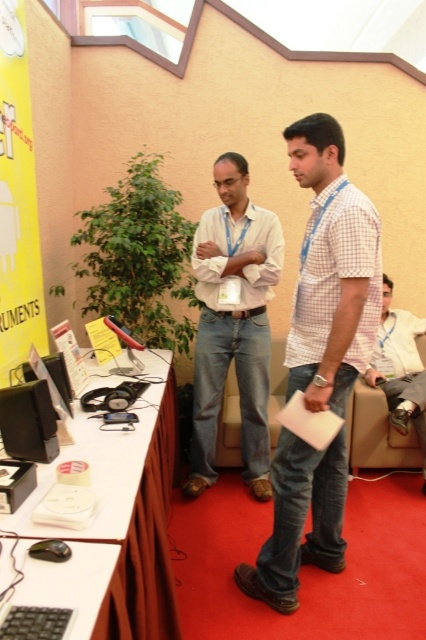
You are organizing a conference and need to place a name tag on the table. The name tag must be placed above the light beige shirt at center. Where should you place it relative to the yellow paper at upper left?

The light beige shirt at center is positioned under the yellow paper at upper left, so to place the name tag above the light beige shirt at center, you should position it between the yellow paper at upper left and the light beige shirt at center.

You are organizing a conference and need to place a name tag on the table. The name tag must be placed to the left of the yellow paper at upper left. Can the light beige shirt at center be used as the name tag location?

The light beige shirt at center is to the right of the yellow paper at upper left, so placing the name tag there would not satisfy the requirement of being to the left of the yellow paper at upper left.

Looking at this image, you are organizing a conference and need to decide whether to place a new folder on the table. The folder is the same size as the yellow paper at upper left. Will it fit in the space currently occupied by the light beige shirt at center?

The light beige shirt at center is bigger than the yellow paper at upper left. Since the folder is the same size as the yellow paper at upper left, it will fit in the space currently occupied by the light beige shirt at center because the shirt takes up more space.